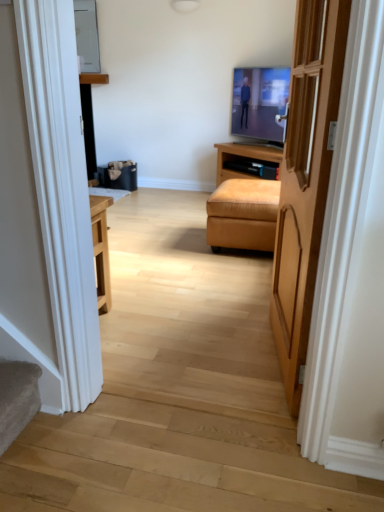
Question: Does point (334, 47) appear closer or farther from the camera than point (246, 240)?

Choices:
 (A) closer
 (B) farther

Answer: (A)

Question: From the image's perspective, is light brown wooden door at center above or below suede-like tan ottoman at center?

Choices:
 (A) above
 (B) below

Answer: (B)

Question: Which object is positioned closest to the flat screen tv at center?

Choices:
 (A) light brown wooden door at center
 (B) suede-like tan ottoman at center

Answer: (B)

Question: Which object is the farthest from the suede-like tan ottoman at center?

Choices:
 (A) light brown wooden door at center
 (B) flat screen tv at center

Answer: (B)